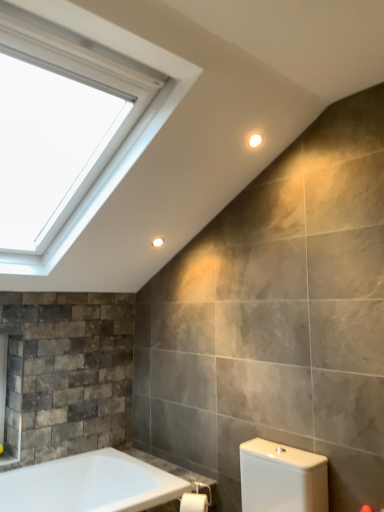
What do you see at coordinates (179, 474) in the screenshot?
I see `white glossy bathtub at lower left` at bounding box center [179, 474].

The width and height of the screenshot is (384, 512). What do you see at coordinates (157, 242) in the screenshot? I see `matte white light fixture at upper center, the first light fixture when ordered from back to front` at bounding box center [157, 242].

Describe the element at coordinates (193, 502) in the screenshot. I see `white matte toilet paper at lower center` at that location.

This screenshot has width=384, height=512. I want to click on white glossy bathtub at lower left, so click(x=179, y=474).

Could you tell me if matte white light fixture at upper center, the 1th light fixture viewed from the top, is facing white matte toilet paper at lower center?

No, matte white light fixture at upper center, the 1th light fixture viewed from the top, is not facing towards white matte toilet paper at lower center.

I want to click on the 2nd light fixture above the white matte toilet paper at lower center (from a real-world perspective), so click(255, 140).

Between matte white light fixture at upper center, arranged as the first light fixture when viewed from the front, and white matte toilet paper at lower center, which one has smaller size?

With smaller size is matte white light fixture at upper center, arranged as the first light fixture when viewed from the front.

Is point (254, 135) closer to viewer compared to point (205, 503)?

Yes, point (254, 135) is in front of point (205, 503).

Is matte white light fixture at upper center, which is the second light fixture from bottom to top, not within white glossy bathtub at lower left?

Yes, matte white light fixture at upper center, which is the second light fixture from bottom to top, is not within white glossy bathtub at lower left.

Who is shorter, matte white light fixture at upper center, which is the second light fixture from bottom to top, or white glossy bathtub at lower left?

Standing shorter between the two is white glossy bathtub at lower left.

Which is further, (253, 139) or (157, 461)?

The point (157, 461) is farther.

From the image's perspective, relative to white glossy bathtub at lower left, is matte white light fixture at upper center, the 1th light fixture viewed from the top, above or below?

Based on their image positions, matte white light fixture at upper center, the 1th light fixture viewed from the top, is located above white glossy bathtub at lower left.

Is white matte toilet paper at lower center positioned behind matte white light fixture at upper center, arranged as the first light fixture when viewed from the front?

No, white matte toilet paper at lower center is closer to the camera.

Is white matte toilet paper at lower center oriented away from matte white light fixture at upper center, arranged as the second light fixture when viewed from the left?

No.

How distant is white matte toilet paper at lower center from matte white light fixture at upper center, the 1th light fixture viewed from the top?

They are 1.79 meters apart.

From the image's perspective, which is above, white matte toilet paper at lower center or matte white light fixture at upper center, which is the 2th light fixture in back-to-front order?

matte white light fixture at upper center, which is the 2th light fixture in back-to-front order, from the image's perspective.

Is white glossy bathtub at lower left far away from matte white light fixture at upper center, which is the 2th light fixture in back-to-front order?

Yes.

From a real-world perspective, who is located lower, white glossy bathtub at lower left or matte white light fixture at upper center, the 1th light fixture viewed from the top?

white glossy bathtub at lower left.

Locate an element on the screen. counter top below the matte white light fixture at upper center, which is the 2th light fixture in back-to-front order (from the image's perspective) is located at coordinates (179, 474).

From their relative heights in the image, would you say white glossy bathtub at lower left is taller or shorter than matte white light fixture at upper center, the 1th light fixture viewed from the top?

Considering their sizes, white glossy bathtub at lower left has less height than matte white light fixture at upper center, the 1th light fixture viewed from the top.

Which is more to the left, white matte toilet paper at lower center or matte white light fixture at upper center, arranged as the first light fixture when ordered from the bottom?

Positioned to the left is matte white light fixture at upper center, arranged as the first light fixture when ordered from the bottom.

How much distance is there between white matte toilet paper at lower center and matte white light fixture at upper center, positioned as the 2th light fixture in right-to-left order?

They are 1.36 meters apart.

From the image's perspective, between white matte toilet paper at lower center and matte white light fixture at upper center, the first light fixture in the left-to-right sequence, which one is located above?

matte white light fixture at upper center, the first light fixture in the left-to-right sequence, from the image's perspective.

Considering the relative sizes of white matte toilet paper at lower center and matte white light fixture at upper center, positioned as the 2th light fixture in right-to-left order, in the image provided, is white matte toilet paper at lower center thinner than matte white light fixture at upper center, positioned as the 2th light fixture in right-to-left order,?

In fact, white matte toilet paper at lower center might be wider than matte white light fixture at upper center, positioned as the 2th light fixture in right-to-left order.

Between matte white light fixture at upper center, arranged as the 2th light fixture when viewed from the front, and white matte toilet paper at lower center, which one has smaller size?

matte white light fixture at upper center, arranged as the 2th light fixture when viewed from the front, is smaller.

From a real-world perspective, is matte white light fixture at upper center, the first light fixture when ordered from back to front, beneath white matte toilet paper at lower center?

No, from a real-world perspective, matte white light fixture at upper center, the first light fixture when ordered from back to front, is not below white matte toilet paper at lower center.

Is matte white light fixture at upper center, which is the second light fixture from top to bottom, spatially inside white matte toilet paper at lower center, or outside of it?

The correct answer is: outside.

Are matte white light fixture at upper center, which is the second light fixture from top to bottom, and white matte toilet paper at lower center far apart?

Yes, matte white light fixture at upper center, which is the second light fixture from top to bottom, and white matte toilet paper at lower center are located far from each other.

From the picture: Does white glossy bathtub at lower left have a larger size compared to white matte toilet paper at lower center?

Yes.

Is white glossy bathtub at lower left oriented towards white matte toilet paper at lower center?

No, white glossy bathtub at lower left is not facing towards white matte toilet paper at lower center.

Is point (197, 481) behind point (186, 497)?

Yes, point (197, 481) is behind point (186, 497).

Image resolution: width=384 pixels, height=512 pixels. I want to click on toilet paper in front of the matte white light fixture at upper center, positioned as the 1th light fixture in right-to-left order, so click(x=193, y=502).

Locate an element on the screen. This screenshot has height=512, width=384. counter top behind the matte white light fixture at upper center, which is the second light fixture from bottom to top is located at coordinates (179, 474).

When comparing their distances from white glossy bathtub at lower left, does matte white light fixture at upper center, the first light fixture when ordered from back to front, or matte white light fixture at upper center, which is the 2th light fixture in back-to-front order, seem further?

Among the two, matte white light fixture at upper center, which is the 2th light fixture in back-to-front order, is located further to white glossy bathtub at lower left.

From the image, which object appears to be farther from matte white light fixture at upper center, arranged as the first light fixture when viewed from the front, white matte toilet paper at lower center or matte white light fixture at upper center, the first light fixture when ordered from back to front?

white matte toilet paper at lower center lies further to matte white light fixture at upper center, arranged as the first light fixture when viewed from the front, than the other object.

Which object lies nearer to the anchor point matte white light fixture at upper center, which is the second light fixture from top to bottom, white matte toilet paper at lower center or matte white light fixture at upper center, arranged as the first light fixture when viewed from the front?

matte white light fixture at upper center, arranged as the first light fixture when viewed from the front.

Estimate the real-world distances between objects in this image. Which object is further from white matte toilet paper at lower center, matte white light fixture at upper center, which is the 2th light fixture in back-to-front order, or matte white light fixture at upper center, arranged as the 2th light fixture when viewed from the front?

matte white light fixture at upper center, which is the 2th light fixture in back-to-front order, is further to white matte toilet paper at lower center.

From the image, which object appears to be farther from matte white light fixture at upper center, the first light fixture when ordered from back to front, white matte toilet paper at lower center or white glossy bathtub at lower left?

white matte toilet paper at lower center is positioned further to the anchor matte white light fixture at upper center, the first light fixture when ordered from back to front.

Estimate the real-world distances between objects in this image. Which object is further from white glossy bathtub at lower left, matte white light fixture at upper center, the 1th light fixture viewed from the top, or white matte toilet paper at lower center?

Based on the image, matte white light fixture at upper center, the 1th light fixture viewed from the top, appears to be further to white glossy bathtub at lower left.

Based on their spatial positions, is white matte toilet paper at lower center or matte white light fixture at upper center, which is the 2th light fixture in back-to-front order, closer to white glossy bathtub at lower left?

white matte toilet paper at lower center lies closer to white glossy bathtub at lower left than the other object.

Estimate the real-world distances between objects in this image. Which object is further from white matte toilet paper at lower center, matte white light fixture at upper center, arranged as the 2th light fixture when viewed from the front, or white glossy bathtub at lower left?

matte white light fixture at upper center, arranged as the 2th light fixture when viewed from the front, lies further to white matte toilet paper at lower center than the other object.

Where is `light fixture between matte white light fixture at upper center, which is the second light fixture from bottom to top, and white glossy bathtub at lower left from top to bottom`? This screenshot has width=384, height=512. light fixture between matte white light fixture at upper center, which is the second light fixture from bottom to top, and white glossy bathtub at lower left from top to bottom is located at coordinates (157, 242).

Where is `toilet paper between matte white light fixture at upper center, the first light fixture in the left-to-right sequence, and white glossy bathtub at lower left vertically`? The width and height of the screenshot is (384, 512). toilet paper between matte white light fixture at upper center, the first light fixture in the left-to-right sequence, and white glossy bathtub at lower left vertically is located at coordinates (193, 502).

The height and width of the screenshot is (512, 384). Identify the location of light fixture between matte white light fixture at upper center, which is the second light fixture from bottom to top, and white matte toilet paper at lower center vertically. (157, 242).

Where is `toilet paper that lies between matte white light fixture at upper center, the 1th light fixture viewed from the top, and white glossy bathtub at lower left from top to bottom`? The image size is (384, 512). toilet paper that lies between matte white light fixture at upper center, the 1th light fixture viewed from the top, and white glossy bathtub at lower left from top to bottom is located at coordinates (193, 502).